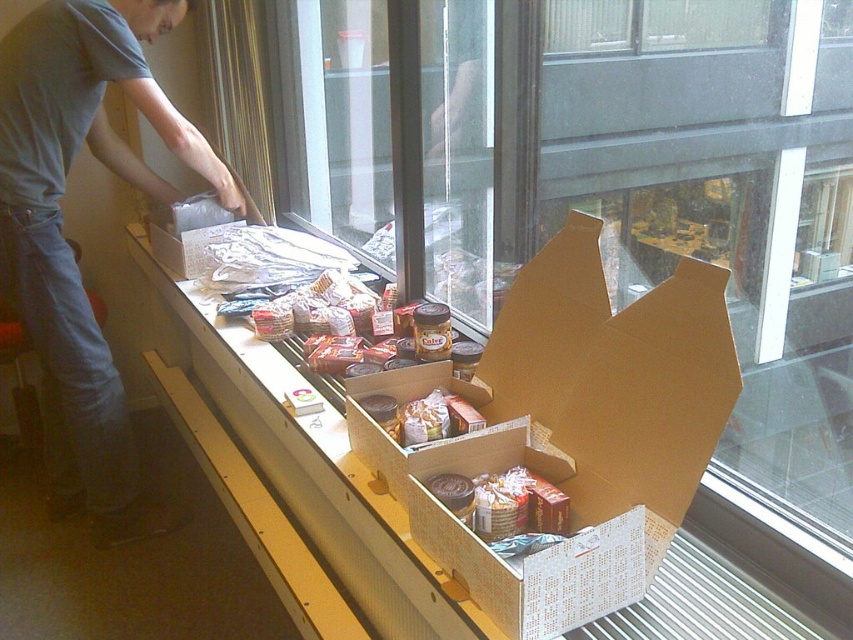
You are a delivery person who needs to place a matte plastic bag of chips at center into a box. The box is already occupied by the gray cotton shirt at upper left. Can you fit the chips bag into the box without removing the shirt?

The gray cotton shirt at upper left is much taller than the matte plastic bag of chips at center, so it might block the space needed for the chips bag. You should check if there is enough vertical space left after accounting for the shirt.

You need to place a 15 cm wide package on the table. Which object, the brown cardboard box at center or the gray cotton shirt at upper left, has enough space to accommodate it?

The gray cotton shirt at upper left has a width greater than the brown cardboard box at center. Therefore, the gray cotton shirt at upper left can accommodate the 15 cm wide package.